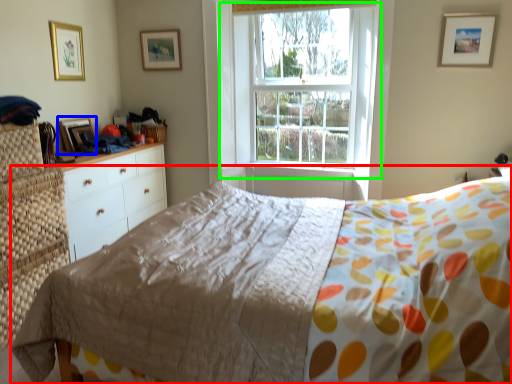
Question: Estimate the real-world distances between objects in this image. Which object is farther from bed (highlighted by a red box), picture frame (highlighted by a blue box) or window (highlighted by a green box)?

Choices:
 (A) picture frame
 (B) window

Answer: (A)